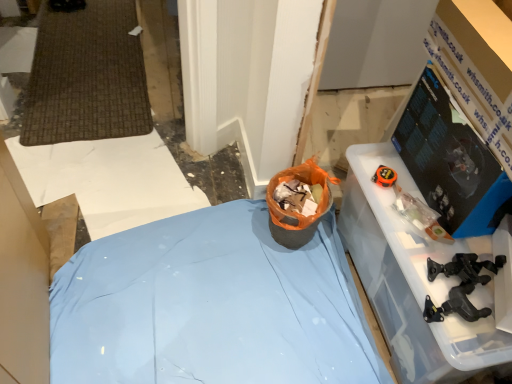
You are a GUI agent. You are given a task and a screenshot of the screen. Output one action in this format:
    pyautogui.click(x=<x>, y=<y>)
    Task: Click on the vacant space underneath blue fabric bed at center, arranged as the first furniture when viewed from the left (from a real-world perspective)
    This screenshot has width=512, height=384.
    Given the screenshot: What is the action you would take?
    pyautogui.click(x=220, y=306)